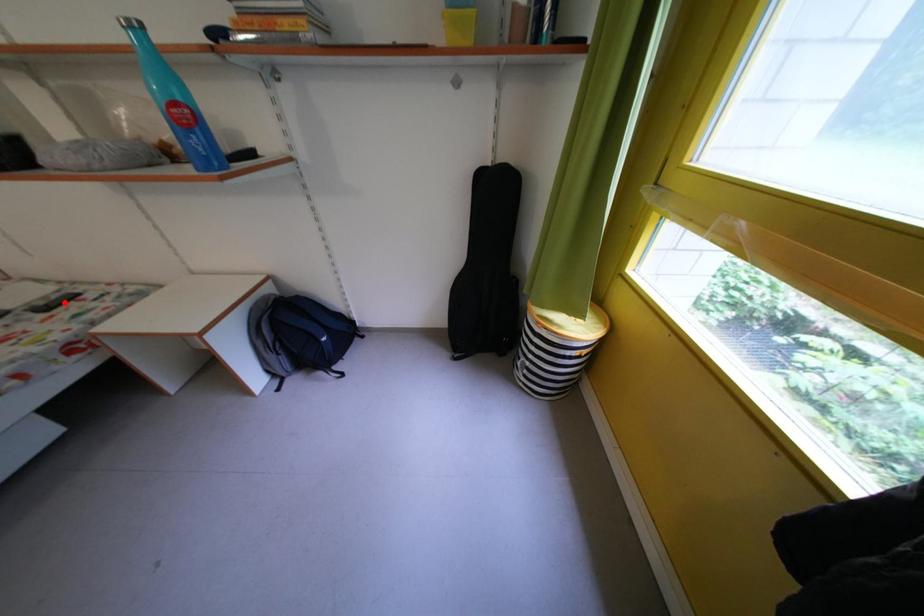
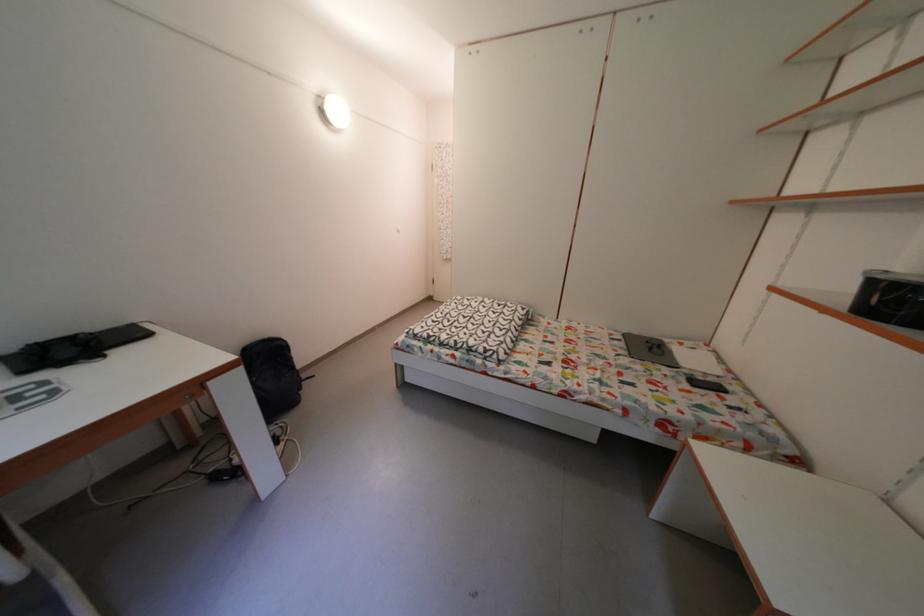
Find the pixel in the second image that matches the highlighted location in the first image.

(721, 385)